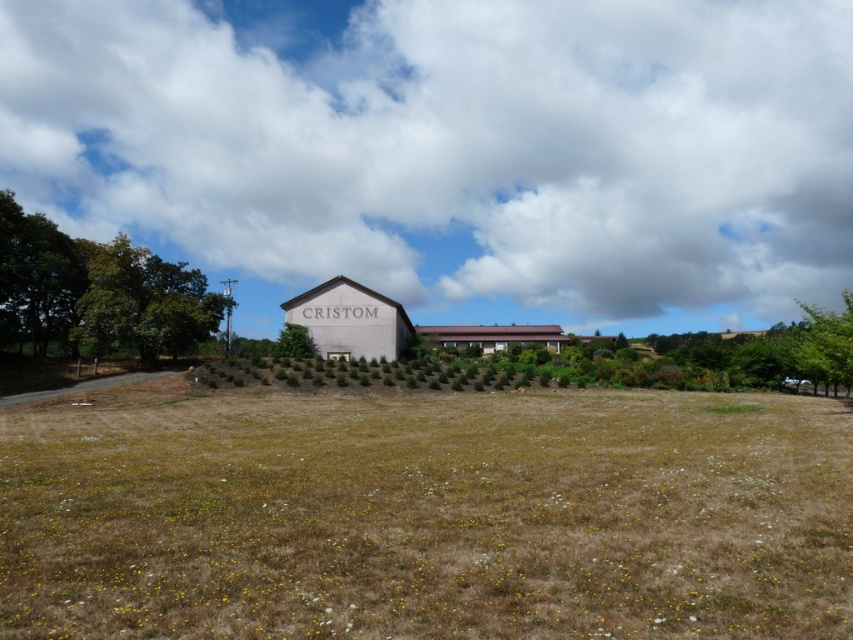
Between white fluffy cloud at upper center and brown corrugated metal barn at center, which one is positioned higher?

white fluffy cloud at upper center is above.

Can you confirm if white fluffy cloud at upper center is positioned above brown corrugated metal barn at center?

Yes, white fluffy cloud at upper center is above brown corrugated metal barn at center.

Which is behind, point (114, 228) or point (554, 346)?

The point (114, 228) is more distant.

Find the location of `white fluffy cloud at upper center`. white fluffy cloud at upper center is located at coordinates (451, 150).

Is point (427, 116) less distant than point (129, 257)?

No, (427, 116) is further to viewer.

Is white fluffy cloud at upper center behind green leafy tree at left?

Yes, white fluffy cloud at upper center is further from the viewer.

What do you see at coordinates (451, 150) in the screenshot? Image resolution: width=853 pixels, height=640 pixels. I see `white fluffy cloud at upper center` at bounding box center [451, 150].

Locate an element on the screen. The width and height of the screenshot is (853, 640). white fluffy cloud at upper center is located at coordinates (451, 150).

Who is higher up, brown grass at lower center or gray concrete barn at center?

gray concrete barn at center is higher up.

Which is more to the right, brown grass at lower center or gray concrete barn at center?

From the viewer's perspective, brown grass at lower center appears more on the right side.

Is point (74, 576) less distant than point (329, 308)?

That is True.

Where is `brown grass at lower center`? brown grass at lower center is located at coordinates (425, 515).